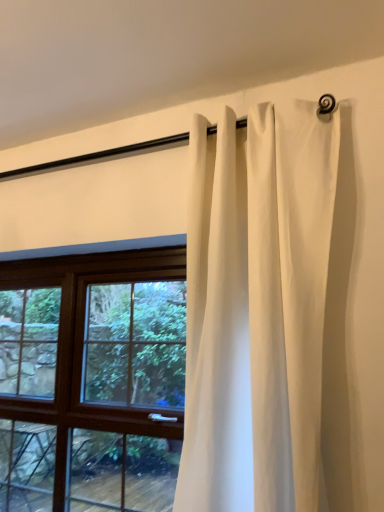
The width and height of the screenshot is (384, 512). What do you see at coordinates (92, 381) in the screenshot?
I see `brown wooden window at center` at bounding box center [92, 381].

The height and width of the screenshot is (512, 384). Find the location of `brown wooden window at center`. brown wooden window at center is located at coordinates (92, 381).

Image resolution: width=384 pixels, height=512 pixels. Describe the element at coordinates (257, 308) in the screenshot. I see `white cotton curtain at upper center` at that location.

What is the approximate height of white cotton curtain at upper center?

The height of white cotton curtain at upper center is 4.61 feet.

Locate an element on the screen. The width and height of the screenshot is (384, 512). white cotton curtain at upper center is located at coordinates (257, 308).

Where is `brown wooden window at center`? This screenshot has height=512, width=384. brown wooden window at center is located at coordinates (92, 381).

Considering the relative positions of white cotton curtain at upper center and brown wooden window at center in the image provided, is white cotton curtain at upper center to the right of brown wooden window at center from the viewer's perspective?

Correct, you'll find white cotton curtain at upper center to the right of brown wooden window at center.

Is the position of white cotton curtain at upper center more distant than that of brown wooden window at center?

No.

Is point (221, 129) positioned in front of point (0, 426)?

Yes.

From the image's perspective, between white cotton curtain at upper center and brown wooden window at center, who is located below?

brown wooden window at center.

From a real-world perspective, is white cotton curtain at upper center physically located above or below brown wooden window at center?

white cotton curtain at upper center is situated higher than brown wooden window at center in the real world.

Looking at their sizes, would you say white cotton curtain at upper center is wider or thinner than brown wooden window at center?

In the image, white cotton curtain at upper center appears to be wider than brown wooden window at center.

Is white cotton curtain at upper center taller than brown wooden window at center?

Yes.

Who is bigger, white cotton curtain at upper center or brown wooden window at center?

white cotton curtain at upper center is bigger.

Is white cotton curtain at upper center located outside brown wooden window at center?

Absolutely, white cotton curtain at upper center is external to brown wooden window at center.

Would you say white cotton curtain at upper center is a long distance from brown wooden window at center?

No, white cotton curtain at upper center is not far from brown wooden window at center.

Does white cotton curtain at upper center turn towards brown wooden window at center?

No, white cotton curtain at upper center is not oriented towards brown wooden window at center.

There is a brown wooden window at center. At what (x,y) coordinates should I click in order to perform the action: click on curtain above it (from a real-world perspective). Please return your answer as a coordinate pair (x, y). This screenshot has width=384, height=512. Looking at the image, I should click on (257, 308).

Considering the relative positions of brown wooden window at center and white cotton curtain at upper center in the image provided, is brown wooden window at center to the left or to the right of white cotton curtain at upper center?

brown wooden window at center is positioned on white cotton curtain at upper center's left side.

Which object is further away from the camera taking this photo, brown wooden window at center or white cotton curtain at upper center?

brown wooden window at center is further from the camera.

Which is nearer, (173, 257) or (320, 260)?

Point (320, 260)

From the image's perspective, would you say brown wooden window at center is positioned over white cotton curtain at upper center?

Incorrect, from the image's perspective, brown wooden window at center is lower than white cotton curtain at upper center.

From a real-world perspective, is brown wooden window at center located beneath white cotton curtain at upper center?

Yes.

Is brown wooden window at center wider or thinner than white cotton curtain at upper center?

Clearly, brown wooden window at center has less width compared to white cotton curtain at upper center.

Considering the sizes of objects brown wooden window at center and white cotton curtain at upper center in the image provided, who is shorter, brown wooden window at center or white cotton curtain at upper center?

brown wooden window at center is shorter.

Is brown wooden window at center smaller than white cotton curtain at upper center?

Correct, brown wooden window at center occupies less space than white cotton curtain at upper center.

Is white cotton curtain at upper center located within brown wooden window at center?

No, white cotton curtain at upper center is not inside brown wooden window at center.

From the picture: Is brown wooden window at center touching white cotton curtain at upper center?

No, brown wooden window at center is not beside white cotton curtain at upper center.

Could you tell me if brown wooden window at center is turned towards white cotton curtain at upper center?

No, brown wooden window at center is not oriented towards white cotton curtain at upper center.

What's the angular difference between brown wooden window at center and white cotton curtain at upper center's facing directions?

The angular difference between brown wooden window at center and white cotton curtain at upper center is 0.074 degrees.

Find the location of `window lying on the left of white cotton curtain at upper center`. window lying on the left of white cotton curtain at upper center is located at coordinates (92, 381).

Find the location of a particular element. This screenshot has width=384, height=512. curtain located in front of the brown wooden window at center is located at coordinates (257, 308).

Identify the location of window below the white cotton curtain at upper center (from the image's perspective). (92, 381).